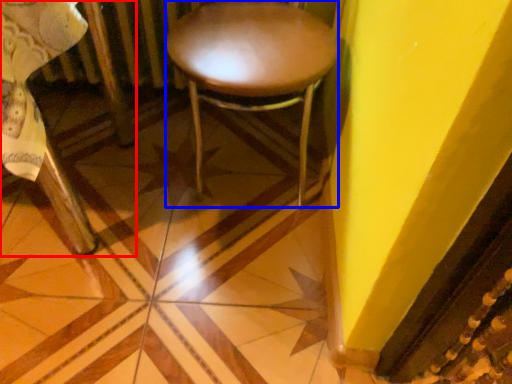
Question: Which of the following is the closest to the observer, chair (highlighted by a red box) or stool (highlighted by a blue box)?

Choices:
 (A) chair
 (B) stool

Answer: (A)